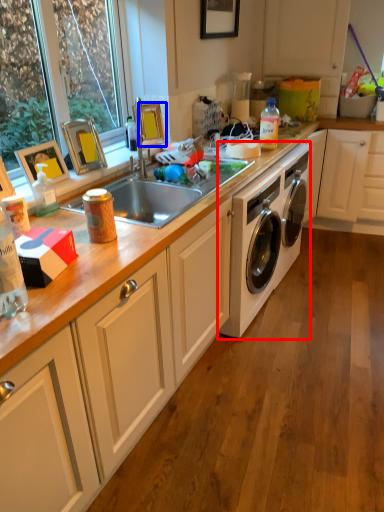
Question: Which object appears farthest to the camera in this image, washing machine (highlighted by a red box) or picture frame (highlighted by a blue box)?

Choices:
 (A) washing machine
 (B) picture frame

Answer: (A)